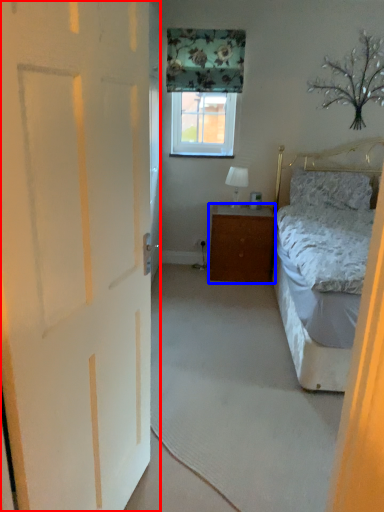
Question: Which point is closer to the camera, door (highlighted by a red box) or cabinetry (highlighted by a blue box)?

Choices:
 (A) door
 (B) cabinetry

Answer: (A)